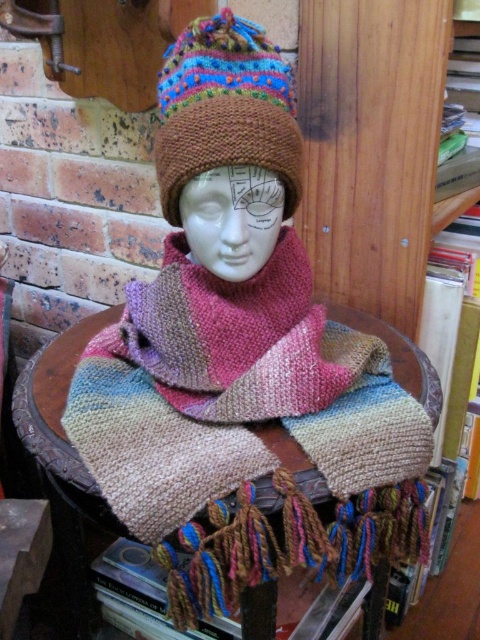
Question: Which object is closer to the camera taking this photo?

Choices:
 (A) knitted fabric at center
 (B) knitted woolen hat at center

Answer: (A)

Question: Which of the following is the closest to the observer?

Choices:
 (A) (264, 76)
 (B) (103, 509)

Answer: (B)

Question: Can you confirm if knitted woolen hat at center is positioned to the left of knitted fabric at center?

Choices:
 (A) yes
 (B) no

Answer: (B)

Question: In this image, where is knitted woolen hat at center located relative to knitted fabric at center?

Choices:
 (A) right
 (B) left

Answer: (A)

Question: Is the position of knitted woolen hat at center more distant than that of knitted fabric at center?

Choices:
 (A) yes
 (B) no

Answer: (A)